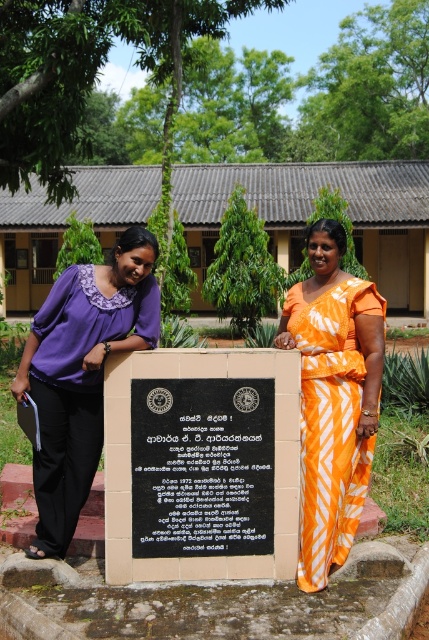
Question: Which object is positioned closest to the orange printed fabric dress at center?

Choices:
 (A) purple fabric blouse at left
 (B) black stone plaque at center

Answer: (B)

Question: Is black stone plaque at center thinner than orange printed fabric dress at center?

Choices:
 (A) no
 (B) yes

Answer: (A)

Question: Which object is positioned closest to the orange printed fabric dress at center?

Choices:
 (A) purple fabric blouse at left
 (B) black stone plaque at center

Answer: (B)

Question: Among these points, which one is nearest to the camera?

Choices:
 (A) (62, 540)
 (B) (341, 465)
 (C) (163, 435)

Answer: (C)

Question: Does black stone plaque at center have a greater width compared to orange printed fabric dress at center?

Choices:
 (A) yes
 (B) no

Answer: (A)

Question: Is the position of black stone plaque at center less distant than that of purple fabric blouse at left?

Choices:
 (A) yes
 (B) no

Answer: (B)